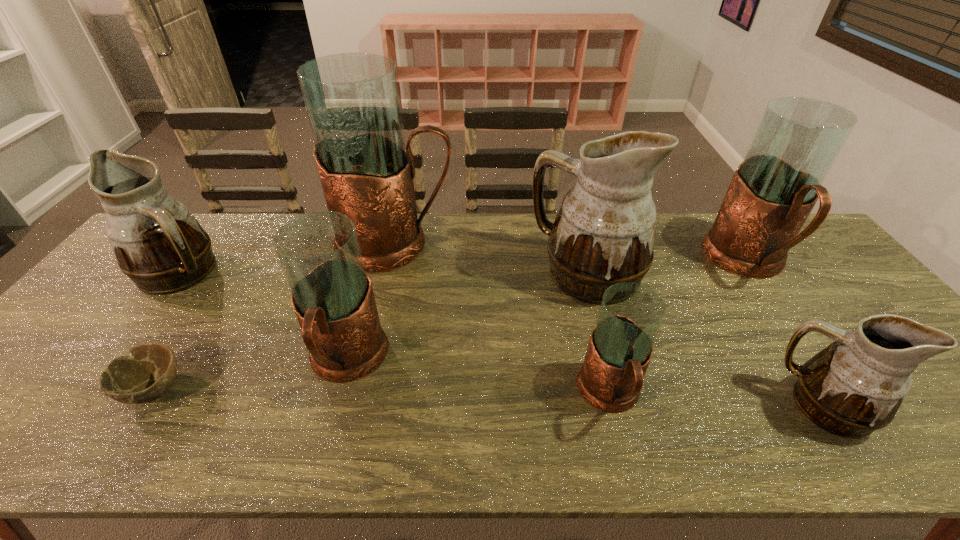
The width and height of the screenshot is (960, 540). I want to click on the tallest pitcher, so click(x=352, y=100).

Identify the location of the biggest gray pitcher. This screenshot has height=540, width=960. (352, 100).

Locate an element on the screen. the rightmost gray pitcher is located at coordinates (773, 191).

Find the location of a particular element. the second brown pitcher from left to right is located at coordinates (604, 233).

At what (x,y) coordinates should I click in order to perform the action: click on the second biggest brown pitcher. Please return your answer as a coordinate pair (x, y). Looking at the image, I should click on (158, 243).

The image size is (960, 540). What are the coordinates of `the leftmost pitcher` in the screenshot? It's located at (158, 243).

The height and width of the screenshot is (540, 960). In order to click on the third biggest gray pitcher in this screenshot , I will do `click(319, 252)`.

Locate an element on the screen. the third gray pitcher from left to right is located at coordinates (620, 347).

Locate an element on the screen. The image size is (960, 540). the nearest brown pitcher is located at coordinates (855, 386).

The width and height of the screenshot is (960, 540). What are the coordinates of `the rightmost brown pitcher` in the screenshot? It's located at (855, 386).